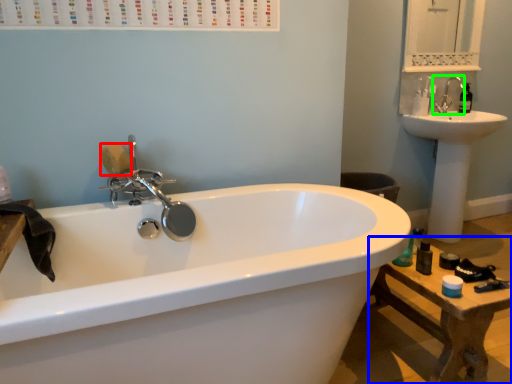
Question: Based on their relative distances, which object is farther from soap (highlighted by a red box)? Choose from table (highlighted by a blue box) and tap (highlighted by a green box).

Choices:
 (A) table
 (B) tap

Answer: (B)